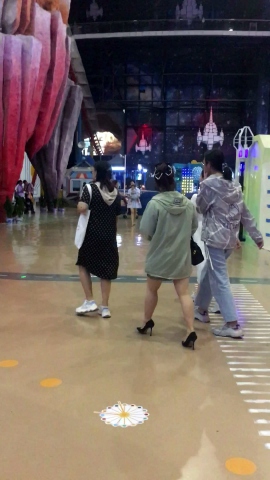
Locate an element on the screen. The width and height of the screenshot is (270, 480). labels on flooring is located at coordinates (7, 361), (50, 382), (129, 420), (235, 466), (252, 304), (263, 368).